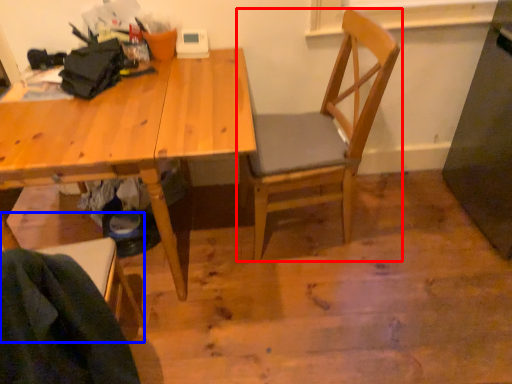
Question: Which object appears closest to the camera in this image, chair (highlighted by a red box) or chair (highlighted by a blue box)?

Choices:
 (A) chair
 (B) chair

Answer: (B)